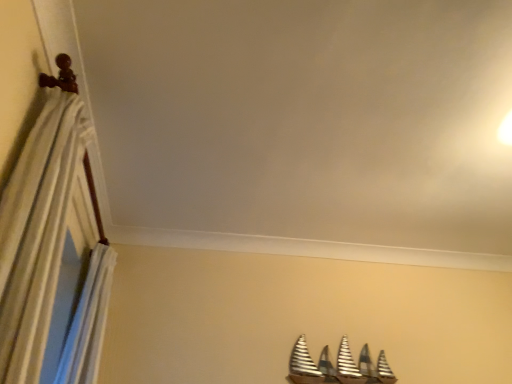
Find the location of a particular element. striped fabric curtain at left is located at coordinates (52, 255).

What do you see at coordinates (52, 255) in the screenshot? I see `striped fabric curtain at left` at bounding box center [52, 255].

What are the coordinates of `striped fabric curtain at left` in the screenshot? It's located at (52, 255).